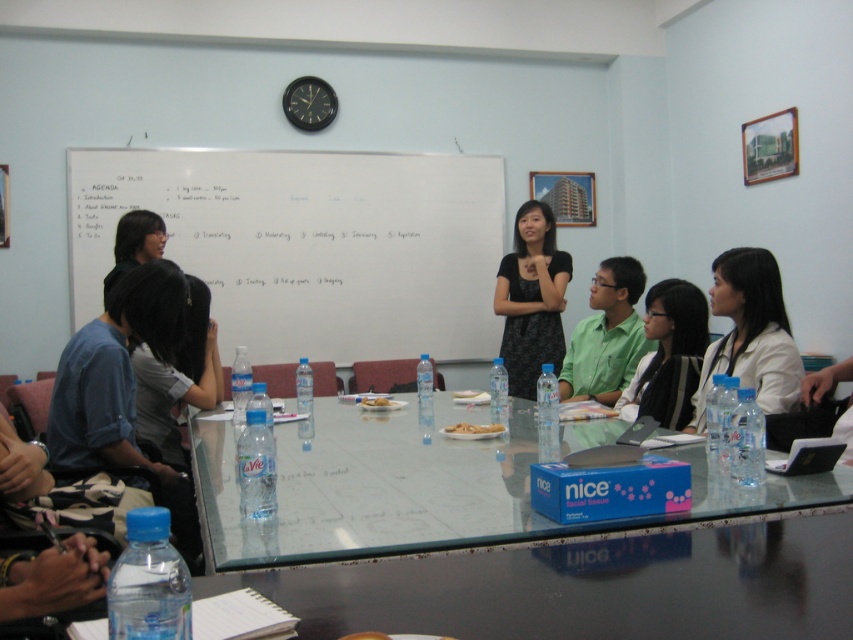
Question: Which point is farther to the camera?

Choices:
 (A) (221, 396)
 (B) (503, 301)
 (C) (793, 385)

Answer: (B)

Question: Does whiteboard at upper center have a greater width compared to green matte shirt at center?

Choices:
 (A) no
 (B) yes

Answer: (B)

Question: Is black matte dress at center positioned in front of matte gray shirt at lower left?

Choices:
 (A) yes
 (B) no

Answer: (B)

Question: Can you confirm if whiteboard at upper center is thinner than transparent glass table at center?

Choices:
 (A) yes
 (B) no

Answer: (B)

Question: Considering the real-world distances, which object is farthest from the whiteboard at upper center?

Choices:
 (A) black glossy hair at center
 (B) transparent glass table at center

Answer: (B)

Question: Which point is farther to the camera?

Choices:
 (A) (770, 352)
 (B) (317, 520)

Answer: (A)